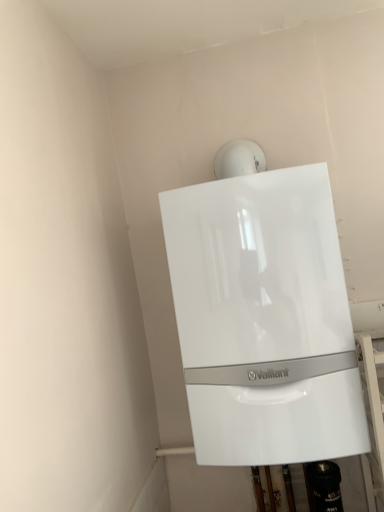
What do you see at coordinates (264, 319) in the screenshot? I see `white glossy vaillant boiler at center` at bounding box center [264, 319].

I want to click on white glossy vaillant boiler at center, so click(x=264, y=319).

You are a GUI agent. You are given a task and a screenshot of the screen. Output one action in this format:
    pyautogui.click(x=<x>, y=<y>)
    Task: Click on the white glossy vaillant boiler at center
    
    Given the screenshot: What is the action you would take?
    pyautogui.click(x=264, y=319)